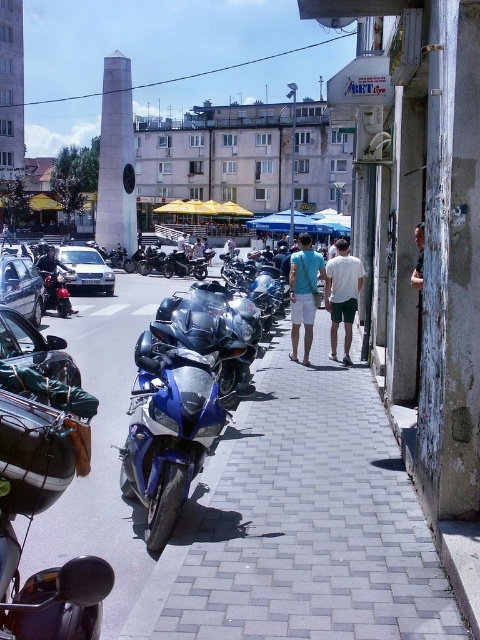
You are a photographer standing in the middle of the street wanting to take a photo of both the glossy metallic motorcycle at center and the shiny chrome motorcycle at left. Which motorcycle will appear larger in your photo?

The glossy metallic motorcycle at center will appear larger in the photo because it is closer to the viewer than the shiny chrome motorcycle at left.

You are a delivery person standing on the sidewalk in front of the parked vehicles. You need to quickly identify which object is taller between the glossy metallic motorcycle at center and the white cotton shirt at center. Based on the scene, which one is taller?

The white cotton shirt at center is taller than the glossy metallic motorcycle at center according to the description.